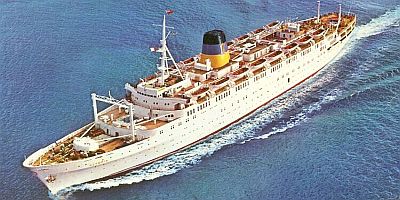
Identify the location of windows. (289, 81), (174, 125), (189, 114), (221, 99), (246, 84), (262, 76), (280, 66).